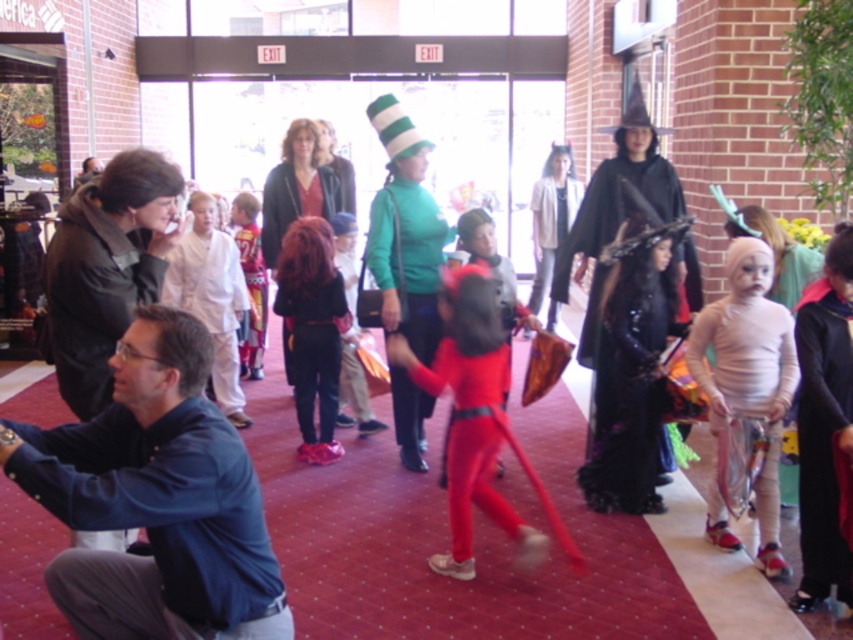
Can you confirm if blue shirt at lower left is smaller than blue fabric shirt at lower left?

Incorrect, blue shirt at lower left is not smaller in size than blue fabric shirt at lower left.

Between blue shirt at lower left and blue fabric shirt at lower left, which one has less height?

With less height is blue shirt at lower left.

You are a GUI agent. You are given a task and a screenshot of the screen. Output one action in this format:
    pyautogui.click(x=<x>, y=<y>)
    Task: Click on the blue shirt at lower left
    
    Given the screenshot: What is the action you would take?
    pyautogui.click(x=155, y=499)

You are a GUI agent. You are given a task and a screenshot of the screen. Output one action in this format:
    pyautogui.click(x=<x>, y=<y>)
    Task: Click on the blue shirt at lower left
    The image size is (853, 640).
    Given the screenshot: What is the action you would take?
    pyautogui.click(x=155, y=499)

Can you confirm if green matte sweater at center is shorter than matte white shirt at center?

No.

What do you see at coordinates (408, 259) in the screenshot? I see `green matte sweater at center` at bounding box center [408, 259].

At what (x,y) coordinates should I click in order to perform the action: click on green matte sweater at center. Please return your answer as a coordinate pair (x, y). Looking at the image, I should click on (408, 259).

Where is `green matte sweater at center`? Image resolution: width=853 pixels, height=640 pixels. green matte sweater at center is located at coordinates (408, 259).

You are a GUI agent. You are given a task and a screenshot of the screen. Output one action in this format:
    pyautogui.click(x=<x>, y=<y>)
    Task: Click on the blue shirt at lower left
    The height and width of the screenshot is (640, 853).
    Given the screenshot: What is the action you would take?
    tap(155, 499)

Which is behind, point (180, 394) or point (189, 262)?

Positioned behind is point (189, 262).

The width and height of the screenshot is (853, 640). Identify the location of blue shirt at lower left. (155, 499).